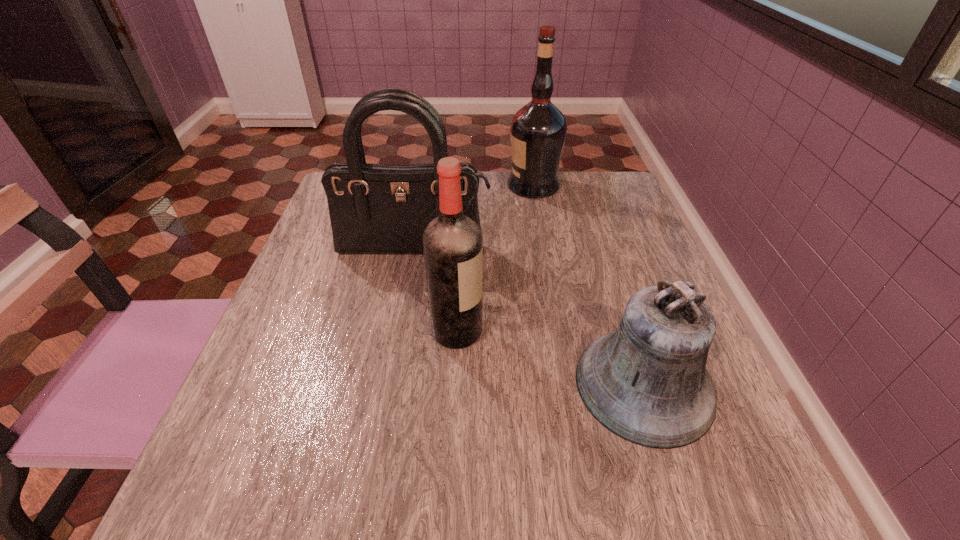
At what (x,y) coordinates should I click in order to perform the action: click on the farthest object. Please return your answer as a coordinate pair (x, y). This screenshot has height=540, width=960. Looking at the image, I should click on (538, 130).

This screenshot has width=960, height=540. In order to click on the right liquor in this screenshot , I will do `click(538, 130)`.

Where is `handbag`? This screenshot has width=960, height=540. handbag is located at coordinates (374, 208).

I want to click on the nearer liquor, so click(x=452, y=243).

Where is `bell`? Image resolution: width=960 pixels, height=540 pixels. bell is located at coordinates (647, 382).

Find the location of `free region located 0.090m on the surface of the farthest object`. free region located 0.090m on the surface of the farthest object is located at coordinates (474, 186).

Where is `free region located on the surface of the farthest object`? free region located on the surface of the farthest object is located at coordinates (398, 186).

Locate an element on the screen. This screenshot has height=540, width=960. free location located 0.260m on the surface of the farthest object is located at coordinates (413, 186).

Image resolution: width=960 pixels, height=540 pixels. In order to click on free space located with an open clasp on the front of the second farthest object in this screenshot , I will do `click(399, 332)`.

I want to click on vacant region located on the front-facing side of the nearer liquor, so click(x=547, y=332).